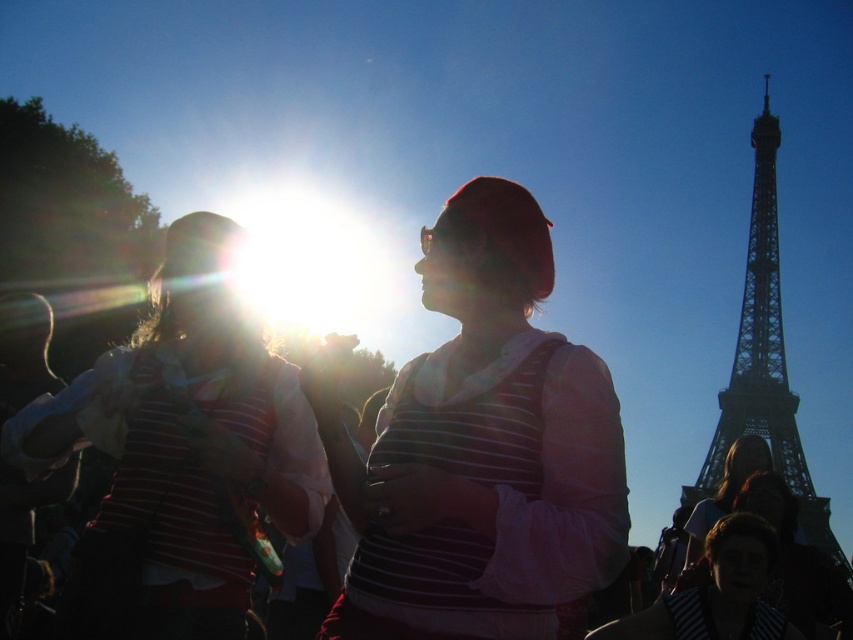
Who is shorter, matte striped shirt at center or dark gray metal eiffel tower at right?

matte striped shirt at center

Does matte striped shirt at center have a greater height compared to dark gray metal eiffel tower at right?

No.

At what (x,y) coordinates should I click in order to perform the action: click on matte striped shirt at center. Please return your answer as a coordinate pair (x, y). Image resolution: width=853 pixels, height=640 pixels. Looking at the image, I should click on (480, 449).

Can you confirm if matte striped shirt at center is positioned below striped fabric shirt at center?

No, matte striped shirt at center is not below striped fabric shirt at center.

This screenshot has height=640, width=853. In order to click on matte striped shirt at center in this screenshot , I will do `click(480, 449)`.

Find the location of a particular element. Image resolution: width=853 pixels, height=640 pixels. matte striped shirt at center is located at coordinates (480, 449).

In the scene shown: Is striped fabric shirt at center shorter than dark gray metal eiffel tower at right?

Yes.

This screenshot has height=640, width=853. Identify the location of striped fabric shirt at center. (187, 440).